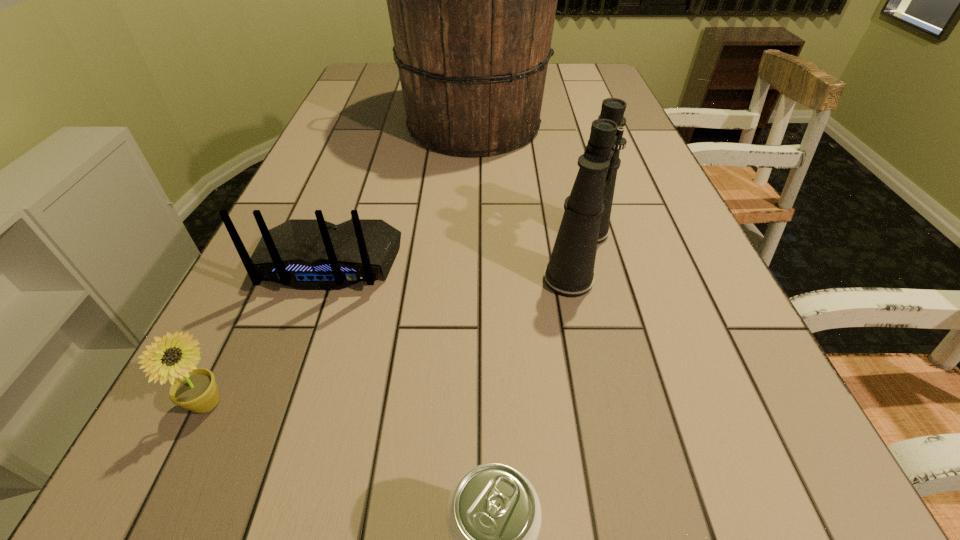
Locate an element on the screen. The image size is (960, 540). sunflower that is at the left edge is located at coordinates point(195,389).

Identify the location of vacant space at the left edge of the desktop. (269, 299).

Identify the location of free space at the right edge. (732, 327).

Image resolution: width=960 pixels, height=540 pixels. I want to click on blank region between the fourth farthest object and the router, so click(269, 333).

Image resolution: width=960 pixels, height=540 pixels. Find the location of `free space that is in between the router and the binoculars`. free space that is in between the router and the binoculars is located at coordinates (454, 258).

Locate an element on the screen. vacant space that's between the binoculars and the sunflower is located at coordinates (393, 330).

Locate an element on the screen. This screenshot has height=540, width=960. free spot between the fourth farthest object and the router is located at coordinates (269, 333).

Locate an element on the screen. Image resolution: width=960 pixels, height=540 pixels. vacant area that lies between the fourth shortest object and the router is located at coordinates (454, 258).

At what (x,y) coordinates should I click in order to perform the action: click on unoccupied position between the farthest object and the router. Please return your answer as a coordinate pair (x, y). Looking at the image, I should click on (398, 193).

Where is `free space that is in between the sunflower and the binoculars`? free space that is in between the sunflower and the binoculars is located at coordinates (393, 330).